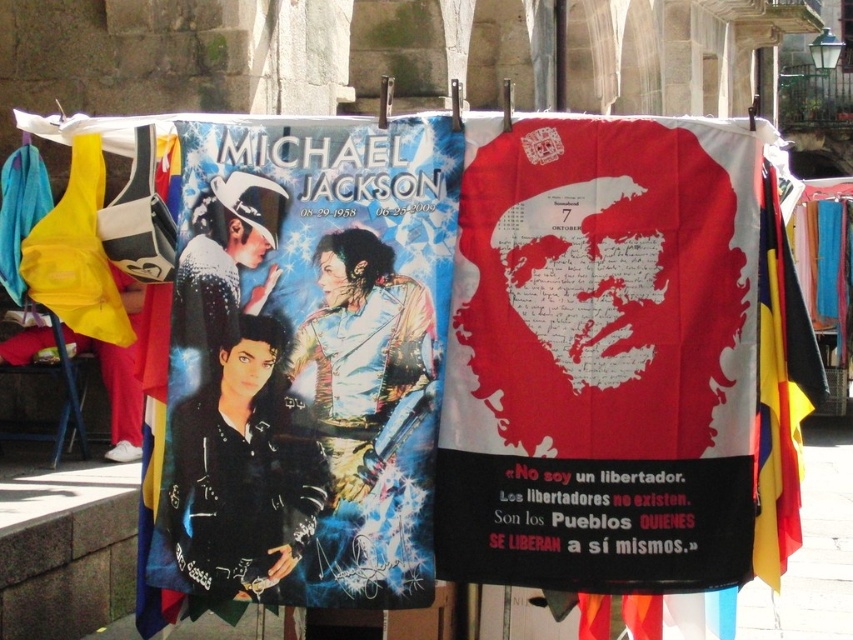
You are a customer at the market and want to hang a new banner between the shiny metallic poster at left and the yellow fabric flag at right. If the new banner must be shorter than both existing banners, can it be placed in the middle between them?

The shiny metallic poster at left is taller than the yellow fabric flag at right. Since the new banner must be shorter than both, it can be placed in the middle between them as long as its height is less than the shorter of the two existing banners, which is the yellow fabric flag at right.